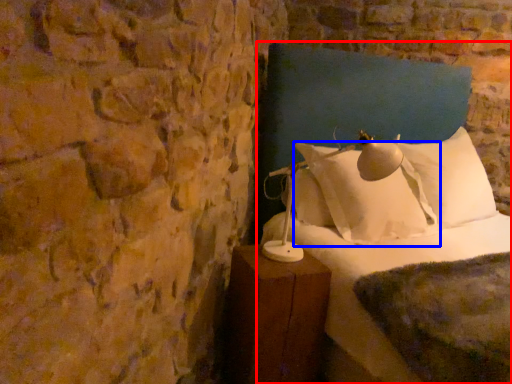
Question: Which point is closer to the camera, bed (highlighted by a red box) or pillow (highlighted by a blue box)?

Choices:
 (A) bed
 (B) pillow

Answer: (A)